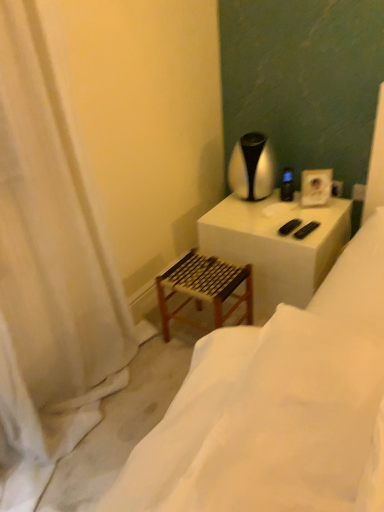
Identify the location of vacant area in front of silver metallic table lamp at upper right. (259, 217).